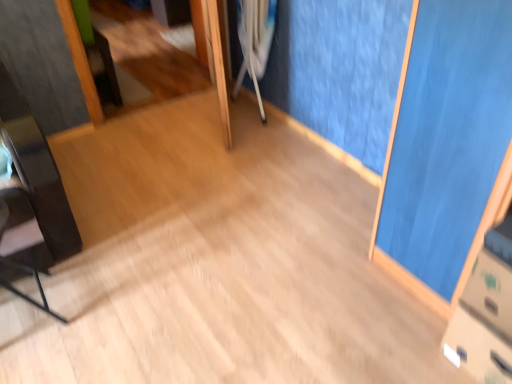
Question: Does matte black chair at left come in front of white plastic crutch at center?

Choices:
 (A) yes
 (B) no

Answer: (A)

Question: From a real-world perspective, is matte black chair at left on white plastic crutch at center?

Choices:
 (A) no
 (B) yes

Answer: (A)

Question: Is matte black chair at left behind white plastic crutch at center?

Choices:
 (A) no
 (B) yes

Answer: (A)

Question: Can you confirm if matte black chair at left is shorter than white plastic crutch at center?

Choices:
 (A) yes
 (B) no

Answer: (A)

Question: Does matte black chair at left turn towards white plastic crutch at center?

Choices:
 (A) yes
 (B) no

Answer: (B)

Question: From the image's perspective, does matte black chair at left appear lower than white plastic crutch at center?

Choices:
 (A) no
 (B) yes

Answer: (B)

Question: Is white plastic crutch at center next to matte black chair at left and touching it?

Choices:
 (A) no
 (B) yes

Answer: (A)

Question: From the image's perspective, is white plastic crutch at center under matte black chair at left?

Choices:
 (A) no
 (B) yes

Answer: (A)

Question: Is white plastic crutch at center behind matte black chair at left?

Choices:
 (A) yes
 (B) no

Answer: (A)

Question: From a real-world perspective, is white plastic crutch at center positioned under matte black chair at left based on gravity?

Choices:
 (A) yes
 (B) no

Answer: (B)

Question: Does white plastic crutch at center have a lesser width compared to matte black chair at left?

Choices:
 (A) no
 (B) yes

Answer: (B)

Question: Considering the relative sizes of white plastic crutch at center and matte black chair at left in the image provided, is white plastic crutch at center smaller than matte black chair at left?

Choices:
 (A) no
 (B) yes

Answer: (A)

Question: Considering their positions, is white plastic crutch at center located in front of or behind matte black chair at left?

Choices:
 (A) behind
 (B) front

Answer: (A)